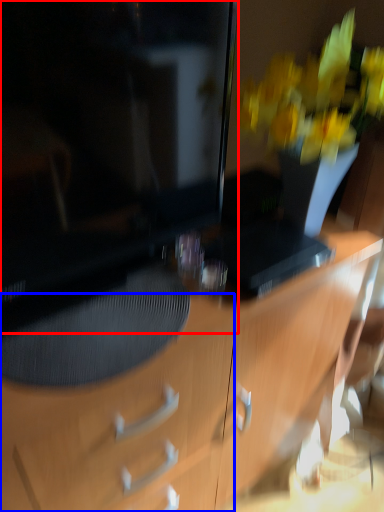
Question: Which of the following is the closest to the observer, television (highlighted by a red box) or drawer (highlighted by a blue box)?

Choices:
 (A) television
 (B) drawer

Answer: (A)